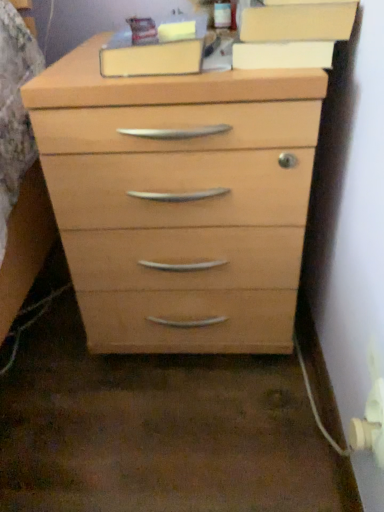
Question: From the image's perspective, is matte wood cabinet at upper center on top of light wood chest of drawers at center?

Choices:
 (A) no
 (B) yes

Answer: (B)

Question: Is the depth of matte wood cabinet at upper center less than that of light wood chest of drawers at center?

Choices:
 (A) yes
 (B) no

Answer: (B)

Question: Considering the relative sizes of matte wood cabinet at upper center and light wood chest of drawers at center in the image provided, is matte wood cabinet at upper center bigger than light wood chest of drawers at center?

Choices:
 (A) yes
 (B) no

Answer: (B)

Question: Is matte wood cabinet at upper center not within light wood chest of drawers at center?

Choices:
 (A) yes
 (B) no

Answer: (A)

Question: Does matte wood cabinet at upper center lie behind light wood chest of drawers at center?

Choices:
 (A) yes
 (B) no

Answer: (A)

Question: From a real-world perspective, is matte wood cabinet at upper center located beneath light wood chest of drawers at center?

Choices:
 (A) no
 (B) yes

Answer: (A)

Question: Can you confirm if light wood chest of drawers at center is taller than matte wood cabinet at upper center?

Choices:
 (A) no
 (B) yes

Answer: (B)

Question: Is the surface of light wood chest of drawers at center in direct contact with matte wood cabinet at upper center?

Choices:
 (A) yes
 (B) no

Answer: (B)

Question: From the image's perspective, is light wood chest of drawers at center over matte wood cabinet at upper center?

Choices:
 (A) yes
 (B) no

Answer: (B)

Question: Is light wood chest of drawers at center surrounding matte wood cabinet at upper center?

Choices:
 (A) yes
 (B) no

Answer: (B)

Question: Is light wood chest of drawers at center looking in the opposite direction of matte wood cabinet at upper center?

Choices:
 (A) no
 (B) yes

Answer: (A)

Question: Does light wood chest of drawers at center have a greater width compared to matte wood cabinet at upper center?

Choices:
 (A) no
 (B) yes

Answer: (B)

Question: Considering the positions of light wood chest of drawers at center and matte wood cabinet at upper center in the image, is light wood chest of drawers at center taller or shorter than matte wood cabinet at upper center?

Choices:
 (A) tall
 (B) short

Answer: (A)